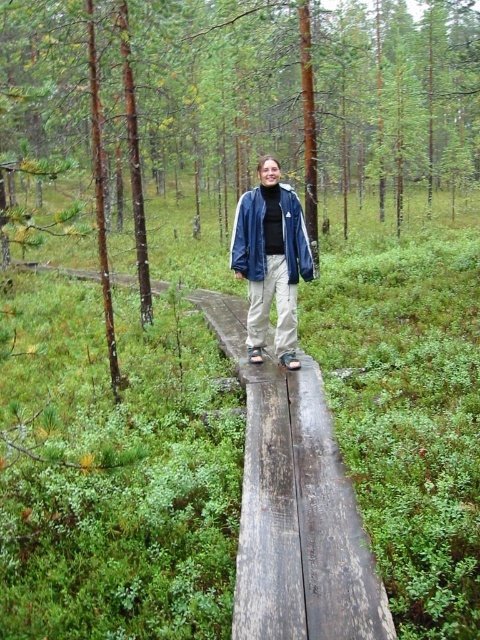
You are a hiker who wants to put on the jackets you have with you. You see both the matte blue jacket at center and the blue denim jacket at center in the image. Which jacket is located below the other?

The matte blue jacket at center is positioned under the blue denim jacket at center, so the matte blue jacket is located below the blue denim jacket.

You are standing on the wooden boardwalk in the forest and want to walk towards the camera. Which point should you step on first, point (250, 227) or point (296, 228)?

Point (250, 227) is in front of point (296, 228), so you should step on point (250, 227) first when walking towards the camera.

You are a hiker who wants to take a photo of the brown wood tree at center and the matte blue jacket at center. Which object should you focus on if you want to capture both in the frame without moving the camera?

The brown wood tree at center might be wider than the matte blue jacket at center, so you should focus on the wider object to ensure both fit in the frame.